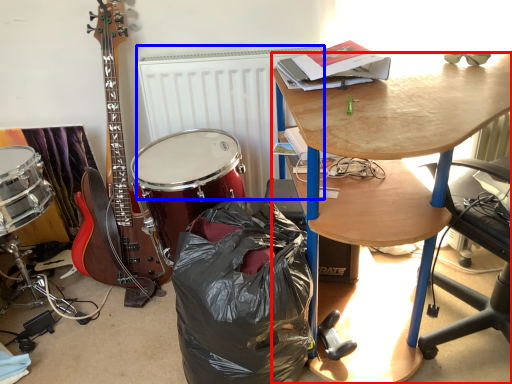
Question: Which object is further to the camera taking this photo, desk (highlighted by a red box) or radiator (highlighted by a blue box)?

Choices:
 (A) desk
 (B) radiator

Answer: (B)